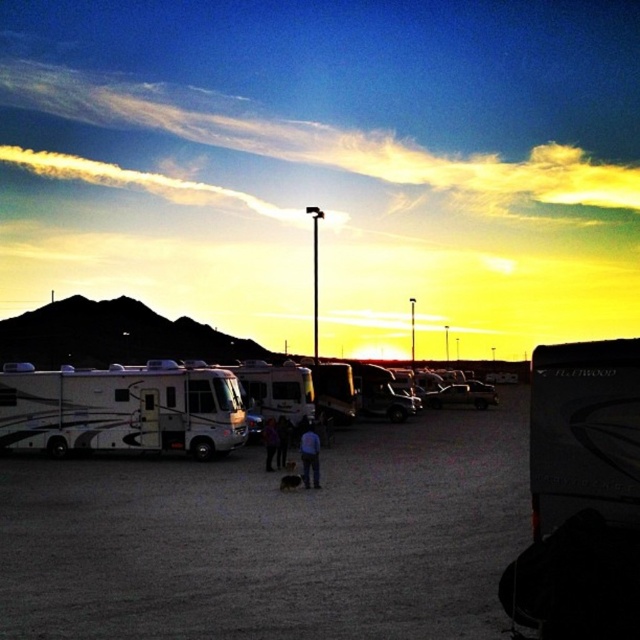
You are planning to take a photo of the metallic silver car at center and the blue jeans at center. Which object should you focus on first if you want to capture both in the same frame without moving the camera?

You should focus on the metallic silver car at center first because it is larger than the blue jeans at center, ensuring it stays in focus while adjusting for the smaller object.

You are a hiker who has just arrived at the campground and wants to park your small tent. You see the white glossy rv at center and the dark blue jeans at center. Which object is closer to you?

The white glossy rv at center is positioned over dark blue jeans at center, meaning it is closer to you.

You are standing at the edge of the campground looking towards the RVs. You see a metallic silver car at center and blue jeans at center. Which object is closer to you?

The metallic silver car at center is closer to you because it is further to the viewer than the blue jeans at center.